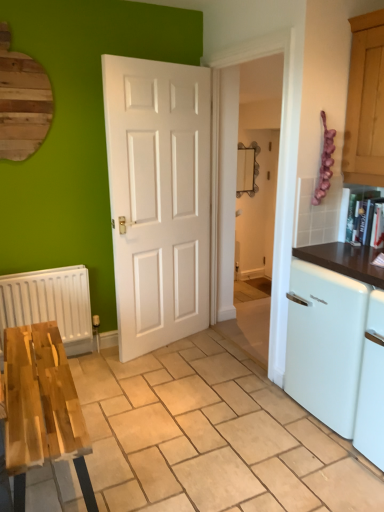
Question: Can you confirm if wooden table at lower left is positioned to the left of white glossy dishwasher at right?

Choices:
 (A) no
 (B) yes

Answer: (B)

Question: Would you say wooden table at lower left is outside white glossy dishwasher at right?

Choices:
 (A) no
 (B) yes

Answer: (B)

Question: From a real-world perspective, is wooden table at lower left beneath white glossy dishwasher at right?

Choices:
 (A) yes
 (B) no

Answer: (A)

Question: Considering the relative positions of wooden table at lower left and white glossy dishwasher at right in the image provided, is wooden table at lower left in front of white glossy dishwasher at right?

Choices:
 (A) no
 (B) yes

Answer: (B)

Question: Is the position of wooden table at lower left more distant than that of white glossy dishwasher at right?

Choices:
 (A) no
 (B) yes

Answer: (A)

Question: Is white glossy dishwasher at right inside wooden table at lower left?

Choices:
 (A) yes
 (B) no

Answer: (B)

Question: From a real-world perspective, is white matte radiator at left on wooden table at lower left?

Choices:
 (A) no
 (B) yes

Answer: (B)

Question: Is white matte radiator at left taller than wooden table at lower left?

Choices:
 (A) no
 (B) yes

Answer: (B)

Question: Is white matte radiator at left to the right of wooden table at lower left from the viewer's perspective?

Choices:
 (A) yes
 (B) no

Answer: (B)

Question: From the image's perspective, is white matte radiator at left on wooden table at lower left?

Choices:
 (A) no
 (B) yes

Answer: (B)

Question: From the image's perspective, would you say white matte radiator at left is shown under wooden table at lower left?

Choices:
 (A) yes
 (B) no

Answer: (B)

Question: Considering the relative positions of white matte radiator at left and wooden table at lower left in the image provided, is white matte radiator at left to the left of wooden table at lower left from the viewer's perspective?

Choices:
 (A) no
 (B) yes

Answer: (B)

Question: Does white glossy dishwasher at right appear on the right side of white matte radiator at left?

Choices:
 (A) no
 (B) yes

Answer: (B)